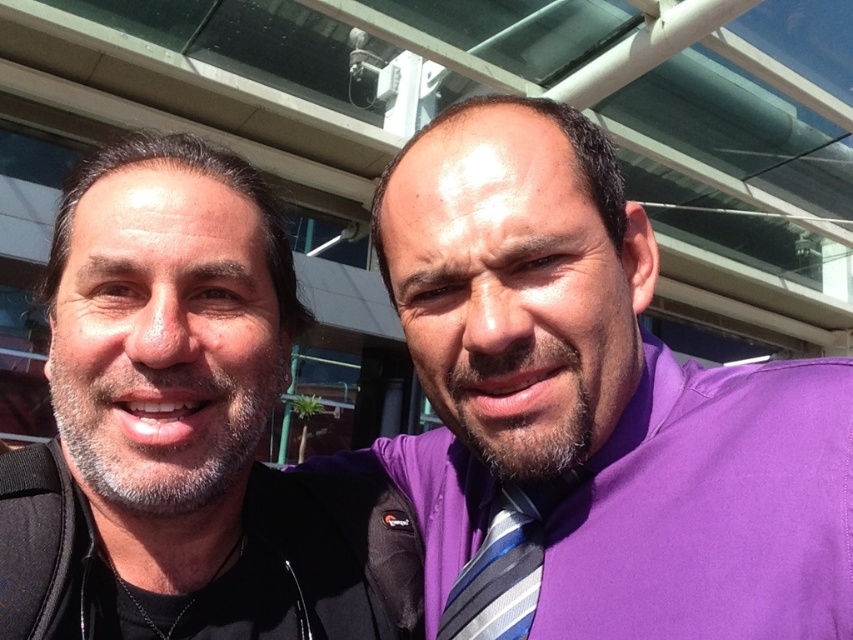
You are taking a photo of two people standing under a glass roof. You notice the black softshell jacket at left and the striped fabric tie at center. Which clothing item is positioned more to the left?

The black softshell jacket at left is positioned more to the left than the striped fabric tie at center.

You are a photographer trying to capture a closeup of the black softshell jacket at left and the striped fabric tie at center. Given that your camera has a minimum focusing distance of 7 inches, will you need to move closer or farther away to ensure both items are in focus?

The black softshell jacket at left is 8.02 inches from the striped fabric tie at center. Since the camera requires a minimum focusing distance of 7 inches, you can move closer to ensure both items are within the focusing range.